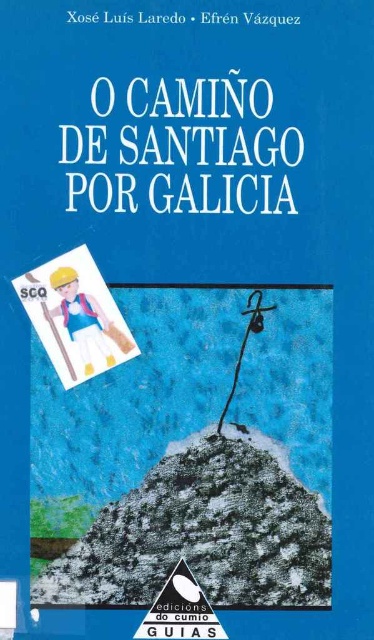
Does white paper sign at upper left lie behind plastic toy figure at upper left?

A: No, it is not.

Is point (50, 321) farther from viewer compared to point (103, 349)?

No, it is in front of (103, 349).

Is point (44, 330) closer to camera compared to point (78, 292)?

Yes, it is.

The image size is (374, 640). Identify the location of white paper sign at upper left. (75, 316).

Identify the location of matte plastic figure at center. (189, 456).

Between point (327, 376) and point (56, 312), which one is positioned in front?

Point (56, 312)

Identify the location of matte plastic figure at center. This screenshot has height=640, width=374. (189, 456).

Which is behind, point (280, 330) or point (114, 301)?

The point (280, 330) is more distant.

Looking at this image, does matte plastic figure at center have a greater height compared to white paper sign at upper left?

Yes.

Is point (145, 502) behind point (62, 260)?

No, it is in front of (62, 260).

The height and width of the screenshot is (640, 374). Find the location of `matte plastic figure at center`. matte plastic figure at center is located at coordinates (189, 456).